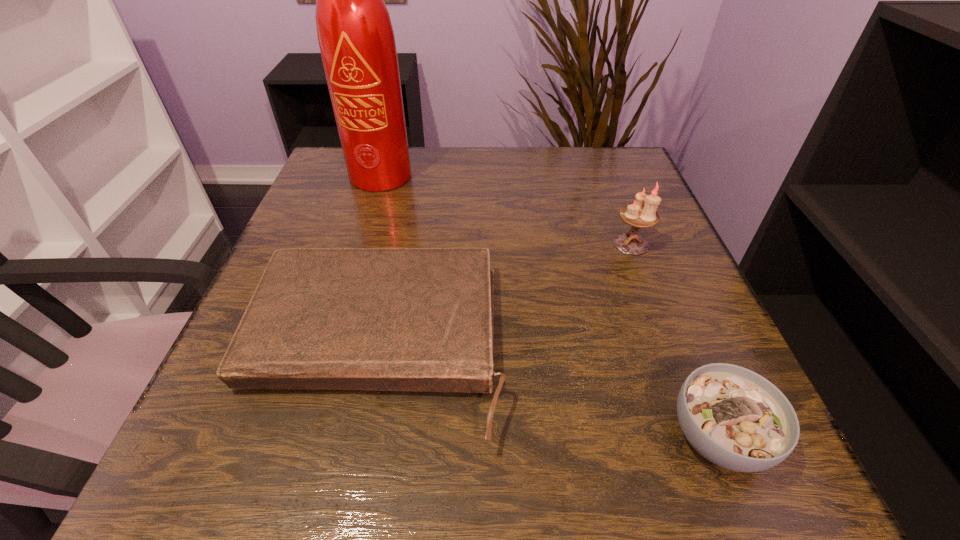
Where is `free area in between the tallest object and the second tallest object`? free area in between the tallest object and the second tallest object is located at coordinates (508, 210).

Locate an element on the screen. free area in between the shortest object and the second shortest object is located at coordinates coord(547,391).

Locate an element on the screen. Image resolution: width=960 pixels, height=540 pixels. free point between the tallest object and the soup bowl is located at coordinates (551, 306).

Image resolution: width=960 pixels, height=540 pixels. Find the location of `vacant space that's between the paperback book and the third nearest object`. vacant space that's between the paperback book and the third nearest object is located at coordinates (503, 295).

Identify the location of vacant region between the third shortest object and the shortest object. The width and height of the screenshot is (960, 540). (503, 295).

Find the location of `free spot between the paperback book and the third shortest object`. free spot between the paperback book and the third shortest object is located at coordinates (503, 295).

Where is `the third closest object to the shortest object`? the third closest object to the shortest object is located at coordinates (355, 34).

Select which object is the closest to the third tallest object. Please provide its 2D coordinates. Your answer should be formatted as a tuple, i.e. [(x, y)], where the tuple contains the x and y coordinates of a point satisfying the conditions above.

[(384, 319)]

You are a GUI agent. You are given a task and a screenshot of the screen. Output one action in this format:
    pyautogui.click(x=<x>, y=<y>)
    Task: Click on the blank area in the image that satisfies the following two spatial constraints: 1. on the spine side of the soup bowl; 2. on the right side of the paperback book
    This screenshot has width=960, height=540.
    Given the screenshot: What is the action you would take?
    pyautogui.click(x=357, y=437)

The image size is (960, 540). Find the location of `vacant space that satisfies the following two spatial constraints: 1. on the spine side of the paperback book; 2. on the right side of the second shortest object`. vacant space that satisfies the following two spatial constraints: 1. on the spine side of the paperback book; 2. on the right side of the second shortest object is located at coordinates (357, 437).